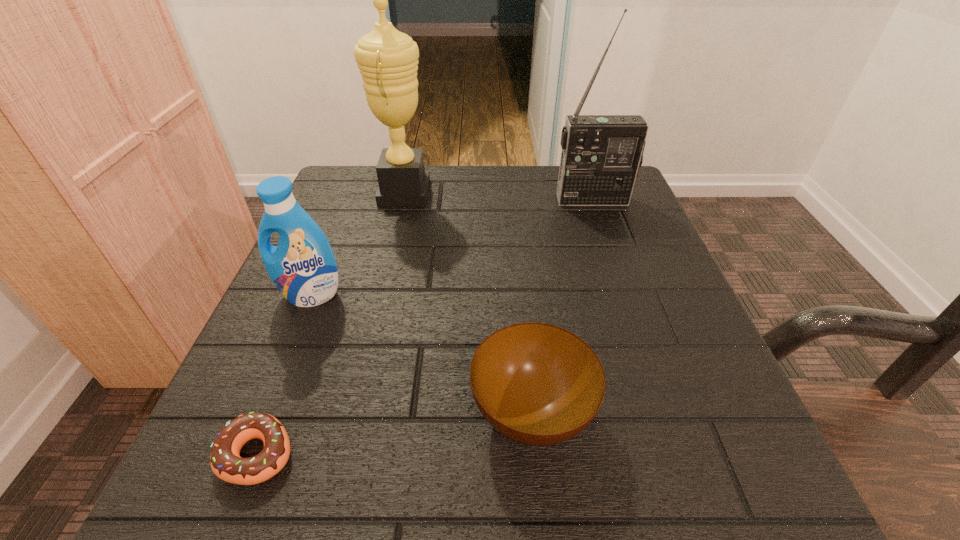
Where is `object that is at the far left corner`? The width and height of the screenshot is (960, 540). object that is at the far left corner is located at coordinates (387, 59).

This screenshot has height=540, width=960. Identify the location of object located in the near left corner section of the desktop. (226, 463).

Where is `object that is positioned at the far right corner`? object that is positioned at the far right corner is located at coordinates (601, 154).

Locate an element on the screen. This screenshot has width=960, height=540. vacant space at the far edge of the desktop is located at coordinates (x=463, y=205).

Find the location of a particular element. Image resolution: width=960 pixels, height=540 pixels. free region at the near edge of the desktop is located at coordinates (383, 498).

What are the coordinates of `free space at the left edge of the desktop` in the screenshot? It's located at click(x=346, y=285).

The height and width of the screenshot is (540, 960). Find the location of `vacant area at the right edge of the desktop`. vacant area at the right edge of the desktop is located at coordinates (666, 370).

This screenshot has height=540, width=960. Find the location of `blank space at the far left corner of the desktop`. blank space at the far left corner of the desktop is located at coordinates (336, 200).

Where is `free space at the far right corner of the desktop`? The image size is (960, 540). free space at the far right corner of the desktop is located at coordinates (559, 166).

The width and height of the screenshot is (960, 540). Identify the location of blank area at the near right corner. (756, 468).